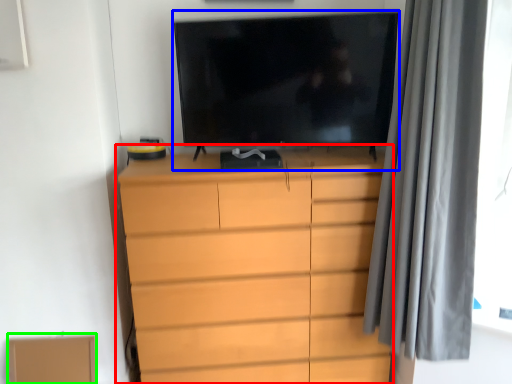
Question: Based on their relative distances, which object is farther from chest of drawers (highlighted by a red box)? Choose from television (highlighted by a blue box) and cardboard box (highlighted by a green box).

Choices:
 (A) television
 (B) cardboard box

Answer: (B)